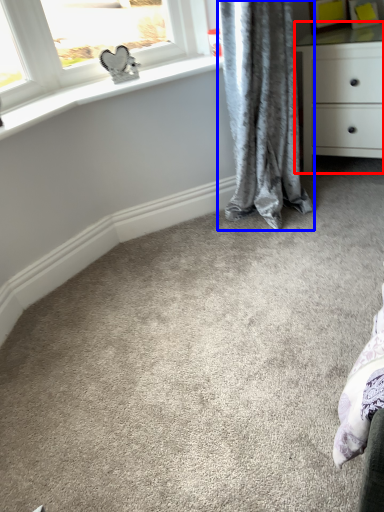
Question: Which object appears closest to the camera in this image, chest of drawers (highlighted by a red box) or curtain (highlighted by a blue box)?

Choices:
 (A) chest of drawers
 (B) curtain

Answer: (B)